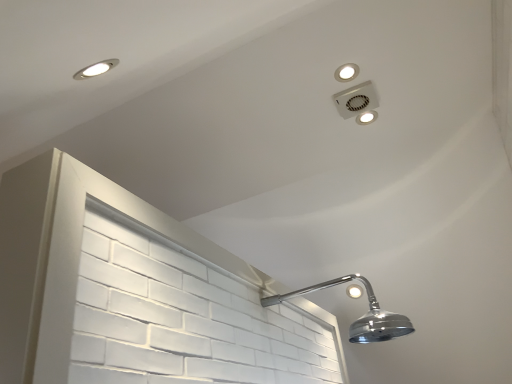
Question: Considering the positions of point (342, 79) and point (366, 120), is point (342, 79) closer or farther from the camera than point (366, 120)?

Choices:
 (A) farther
 (B) closer

Answer: (B)

Question: Considering the positions of white plastic light fixture at upper center, the 1th dot in the front-to-back sequence, and matte white light fixture at upper right, the first dot viewed from the right, in the image, is white plastic light fixture at upper center, the 1th dot in the front-to-back sequence, wider or thinner than matte white light fixture at upper right, the first dot viewed from the right,?

Choices:
 (A) wide
 (B) thin

Answer: (A)

Question: Which object is positioned farthest from the white plastic light fixture at upper center, the first dot viewed from the left?

Choices:
 (A) white plastic vent at upper right
 (B) matte white light fixture at upper right, which appears as the 1th dot when viewed from the back

Answer: (B)

Question: Estimate the real-world distances between objects in this image. Which object is farther from the white plastic vent at upper right?

Choices:
 (A) matte white light fixture at upper right, the 1th dot in the bottom-to-top sequence
 (B) white plastic light fixture at upper center, the 1th dot in the front-to-back sequence

Answer: (B)